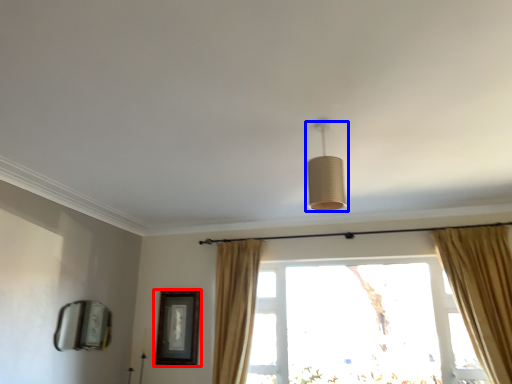
Question: Among these objects, which one is farthest to the camera, picture frame (highlighted by a red box) or lamp (highlighted by a blue box)?

Choices:
 (A) picture frame
 (B) lamp

Answer: (A)